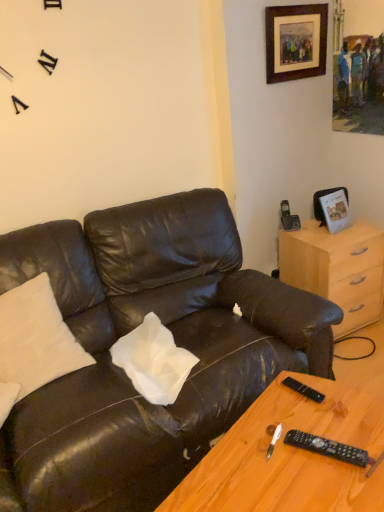
Locate an element on the screen. The height and width of the screenshot is (512, 384). vacant space situated above wooden table at lower right (from a real-world perspective) is located at coordinates (294, 448).